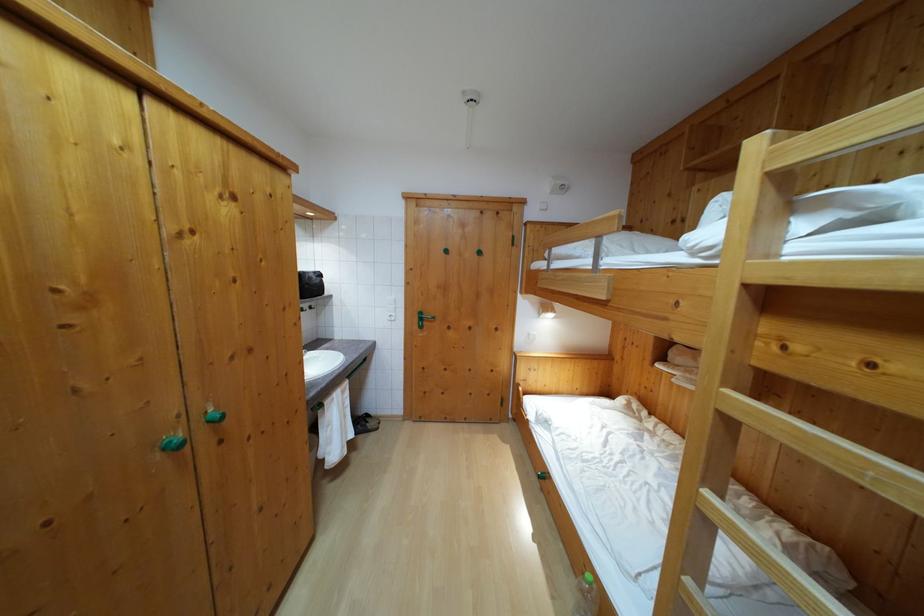
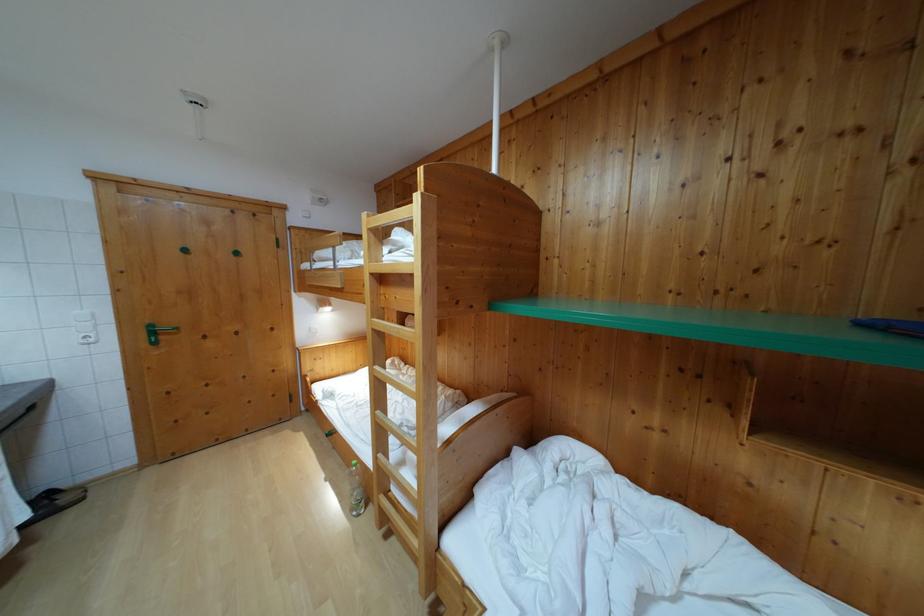
Question: The first image is from the beginning of the video and the second image is from the end. How did the camera likely rotate when shooting the video?

Choices:
 (A) Left
 (B) Right
 (C) Up
 (D) Down

Answer: (B)